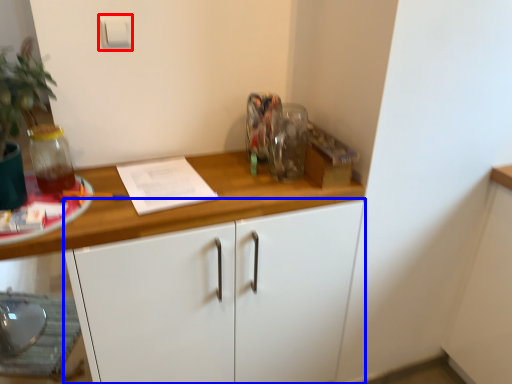
Question: Which of the following is the closest to the observer, light switch (highlighted by a red box) or cabinetry (highlighted by a blue box)?

Choices:
 (A) light switch
 (B) cabinetry

Answer: (B)